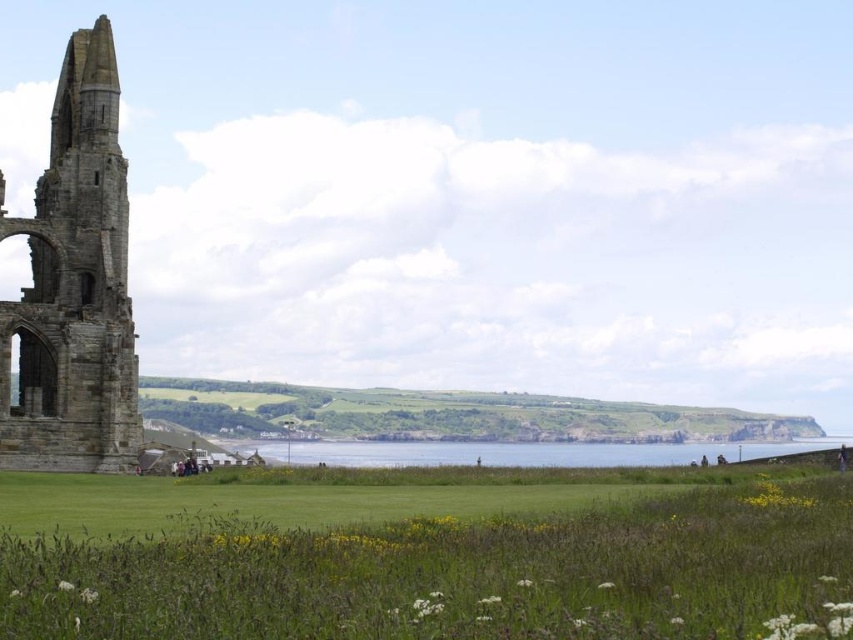
What do you see at coordinates (426, 556) in the screenshot? The image size is (853, 640). I see `green grassy field at lower center` at bounding box center [426, 556].

Can you confirm if green grassy field at lower center is bigger than stone tower at left?

Indeed, green grassy field at lower center has a larger size compared to stone tower at left.

Is point (132, 600) closer to camera compared to point (103, 156)?

Yes, point (132, 600) is in front of point (103, 156).

Where is `green grassy field at lower center`? The height and width of the screenshot is (640, 853). green grassy field at lower center is located at coordinates (426, 556).

Does stone tower at left have a greater height compared to clear blue water at center?

Yes.

Can you confirm if stone tower at left is smaller than clear blue water at center?

Actually, stone tower at left might be larger than clear blue water at center.

Which is behind, point (22, 346) or point (408, 458)?

Positioned behind is point (408, 458).

You are a GUI agent. You are given a task and a screenshot of the screen. Output one action in this format:
    pyautogui.click(x=<x>, y=<y>)
    Task: Click on the stone tower at left
    This screenshot has height=640, width=853.
    Given the screenshot: What is the action you would take?
    pyautogui.click(x=74, y=285)

From the picture: Is green grassy field at lower center shorter than clear blue water at center?

Incorrect, green grassy field at lower center's height does not fall short of clear blue water at center's.

Does green grassy field at lower center have a lesser width compared to clear blue water at center?

Incorrect, green grassy field at lower center's width is not less than clear blue water at center's.

You are a GUI agent. You are given a task and a screenshot of the screen. Output one action in this format:
    pyautogui.click(x=<x>, y=<y>)
    Task: Click on the green grassy field at lower center
    The height and width of the screenshot is (640, 853).
    Given the screenshot: What is the action you would take?
    pyautogui.click(x=426, y=556)